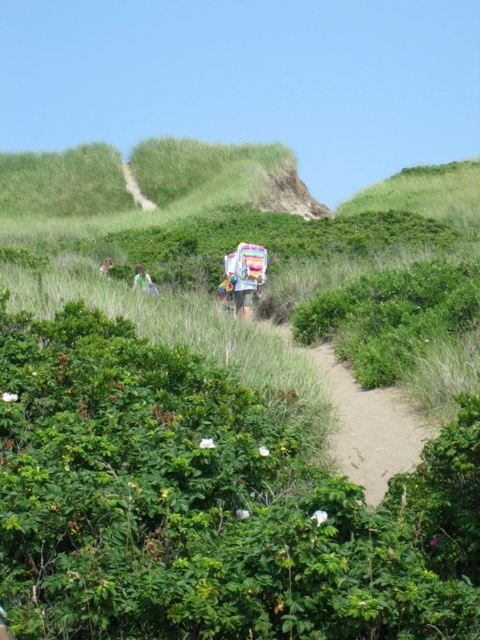
Question: Does brown sandy path at center appear on the left side of green fabric bag at left?

Choices:
 (A) yes
 (B) no

Answer: (B)

Question: Is brown sandy path at center thinner than light brown fabric at center?

Choices:
 (A) yes
 (B) no

Answer: (B)

Question: Among these points, which one is farthest from the camera?

Choices:
 (A) (337, 378)
 (B) (133, 280)
 (C) (106, 273)

Answer: (C)

Question: Which point is closer to the camera?

Choices:
 (A) (100, 269)
 (B) (340, 374)
 (C) (144, 273)

Answer: (B)

Question: Where is brown sandy path at center located in relation to light brown fabric at center in the image?

Choices:
 (A) left
 (B) right

Answer: (B)

Question: Which of the following is the farthest from the observer?

Choices:
 (A) light brown fabric at center
 (B) brown sandy path at center

Answer: (A)